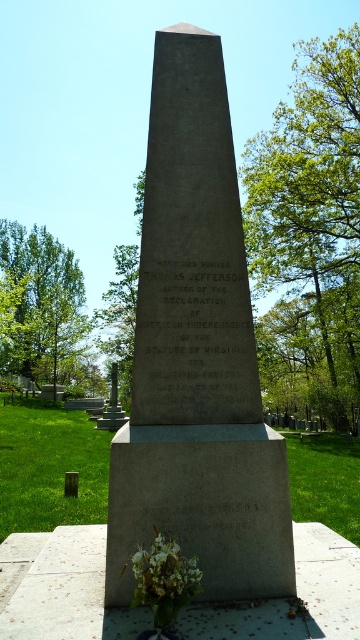
Is point (240, 394) closer to camera compared to point (16, 241)?

That is True.

The image size is (360, 640). In order to click on gray stone monument at center in this screenshot , I will do `click(196, 355)`.

Between green leafy tree at upper right and white matte flowers at lower center, which one is positioned lower?

Positioned lower is white matte flowers at lower center.

Where is `green leafy tree at upper right`? This screenshot has height=640, width=360. green leafy tree at upper right is located at coordinates (309, 232).

The height and width of the screenshot is (640, 360). Find the location of `green leafy tree at left`. green leafy tree at left is located at coordinates (41, 300).

Who is taller, green leafy tree at left or white matte flowers at lower center?

Standing taller between the two is green leafy tree at left.

Is point (38, 253) farther from viewer compared to point (168, 547)?

That is True.

This screenshot has height=640, width=360. Find the location of `green leafy tree at left`. green leafy tree at left is located at coordinates (41, 300).